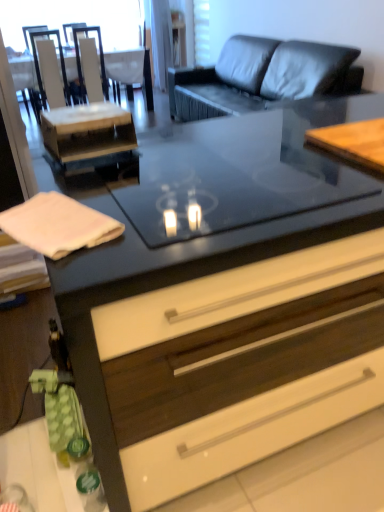
This screenshot has width=384, height=512. Describe the element at coordinates (132, 68) in the screenshot. I see `white wood desk at left` at that location.

You are a GUI agent. You are given a task and a screenshot of the screen. Output one action in this format:
    pyautogui.click(x=<x>, y=<y>)
    Task: Click on the wooden at left
    The width and height of the screenshot is (384, 512).
    Given the screenshot: What is the action you would take?
    pyautogui.click(x=89, y=136)

Find the location of a particular element. Image resolution: width=384 pixels, height=512 pixels. white fabric armchair at upper center, arranged as the 1th armchair when viewed from the right is located at coordinates pyautogui.click(x=130, y=72).

This screenshot has height=512, width=384. What do you see at coordinates (100, 60) in the screenshot?
I see `white glossy armchair at upper left, which is counted as the 2th armchair, starting from the right` at bounding box center [100, 60].

The width and height of the screenshot is (384, 512). Identify the location of matte black drawer at center. (240, 364).

The height and width of the screenshot is (512, 384). Describe the element at coordinates (261, 77) in the screenshot. I see `dark gray leather couch at upper center` at that location.

In order to face white glossy armchair at upper left, the first armchair when ordered from left to right, should I rotate leftwards or rightwards?

To face it directly, rotate left by 18.626 degrees.

Identify the location of white wood desk at left. The width and height of the screenshot is (384, 512). (132, 68).

Considering the relative sizes of white fabric armchair at upper center, which is counted as the 3th armchair, starting from the left, and white wood desk at left in the image provided, is white fabric armchair at upper center, which is counted as the 3th armchair, starting from the left, smaller than white wood desk at left?

Indeed, white fabric armchair at upper center, which is counted as the 3th armchair, starting from the left, has a smaller size compared to white wood desk at left.

Which object is thinner, white fabric armchair at upper center, arranged as the 1th armchair when viewed from the right, or white wood desk at left?

With smaller width is white fabric armchair at upper center, arranged as the 1th armchair when viewed from the right.

Could you tell me if white fabric armchair at upper center, which is counted as the 3th armchair, starting from the left, is facing white wood desk at left?

Yes, white fabric armchair at upper center, which is counted as the 3th armchair, starting from the left, is turned towards white wood desk at left.

From the image's perspective, who appears lower, wooden at left or dark gray leather couch at upper center?

wooden at left is shown below in the image.

From their relative heights in the image, would you say wooden at left is taller or shorter than dark gray leather couch at upper center?

wooden at left is shorter than dark gray leather couch at upper center.

The height and width of the screenshot is (512, 384). What are the coordinates of `studio couch above the wooden at left (from the image's perspective)` in the screenshot? It's located at (261, 77).

Between wooden at left and dark gray leather couch at upper center, which one is positioned in front?

Positioned in front is wooden at left.

From a real-world perspective, which object stands above the other?

white glossy armchair at upper left, which is counted as the 2th armchair, starting from the right, from a real-world perspective.

Does white glossy armchair at upper left, which is counted as the 2th armchair, starting from the right, have a lesser width compared to white wood desk at left?

Yes, white glossy armchair at upper left, which is counted as the 2th armchair, starting from the right, is thinner than white wood desk at left.

Is white glossy armchair at upper left, placed as the 2th armchair when sorted from left to right, oriented away from white wood desk at left?

Yes, white glossy armchair at upper left, placed as the 2th armchair when sorted from left to right, is positioned with its back facing white wood desk at left.

From the image's perspective, is white glossy armchair at upper left, placed as the 2th armchair when sorted from left to right, on white wood desk at left?

Yes, from the image's perspective, white glossy armchair at upper left, placed as the 2th armchair when sorted from left to right, is above white wood desk at left.

Which point is more forward, (x=110, y=70) or (x=40, y=62)?

Positioned in front is point (x=40, y=62).

Would you say white wood desk at left contains white glossy armchair at upper left, which ranks as the 3th armchair in right-to-left order?

Yes, white glossy armchair at upper left, which ranks as the 3th armchair in right-to-left order, is a part of white wood desk at left.

Can you tell me how much white wood desk at left and white glossy armchair at upper left, which ranks as the 3th armchair in right-to-left order, differ in facing direction?

The angular difference between white wood desk at left and white glossy armchair at upper left, which ranks as the 3th armchair in right-to-left order, is 0.467 degrees.

Is white wood desk at left with white glossy armchair at upper left, the first armchair when ordered from left to right?

No, white wood desk at left is not next to white glossy armchair at upper left, the first armchair when ordered from left to right.

From the image's perspective, is wooden table at upper right located above or below dark gray leather couch at upper center?

From the image's perspective, wooden table at upper right appears below dark gray leather couch at upper center.

Would you say wooden table at upper right is inside or outside dark gray leather couch at upper center?

wooden table at upper right is outside dark gray leather couch at upper center.

Is the depth of wooden table at upper right greater than that of dark gray leather couch at upper center?

No.

Can you confirm if wooden table at upper right is thinner than dark gray leather couch at upper center?

Correct, the width of wooden table at upper right is less than that of dark gray leather couch at upper center.

Looking at this image, would you say wooden table at upper right is a long distance from white glossy armchair at upper left, which ranks as the 3th armchair in right-to-left order?

wooden table at upper right is far away from white glossy armchair at upper left, which ranks as the 3th armchair in right-to-left order.

Considering the sizes of wooden table at upper right and white glossy armchair at upper left, which ranks as the 3th armchair in right-to-left order, in the image, is wooden table at upper right wider or thinner than white glossy armchair at upper left, which ranks as the 3th armchair in right-to-left order,?

Clearly, wooden table at upper right has less width compared to white glossy armchair at upper left, which ranks as the 3th armchair in right-to-left order.

Is wooden table at upper right further to camera compared to white glossy armchair at upper left, which ranks as the 3th armchair in right-to-left order?

No, wooden table at upper right is in front of white glossy armchair at upper left, which ranks as the 3th armchair in right-to-left order.

From the image's perspective, who appears lower, wooden table at upper right or white glossy armchair at upper left, which ranks as the 3th armchair in right-to-left order?

wooden table at upper right is shown below in the image.

From their relative heights in the image, would you say matte black drawer at center is taller or shorter than white glossy armchair at upper left, placed as the 2th armchair when sorted from left to right?

Considering their sizes, matte black drawer at center has more height than white glossy armchair at upper left, placed as the 2th armchair when sorted from left to right.

Which is more to the right, matte black drawer at center or white glossy armchair at upper left, which is counted as the 2th armchair, starting from the right?

Positioned to the right is matte black drawer at center.

From the image's perspective, who appears lower, matte black drawer at center or white glossy armchair at upper left, which is counted as the 2th armchair, starting from the right?

matte black drawer at center, from the image's perspective.

Does matte black drawer at center have a lesser width compared to white glossy armchair at upper left, which is counted as the 2th armchair, starting from the right?

Incorrect, the width of matte black drawer at center is not less than that of white glossy armchair at upper left, which is counted as the 2th armchair, starting from the right.

Which armchair is the 2nd one when counting from the right side of the white wood desk at left? Please provide its 2D coordinates.

[(130, 72)]

Where is `side table lying in front of the dark gray leather couch at upper center`? This screenshot has width=384, height=512. side table lying in front of the dark gray leather couch at upper center is located at coordinates (89, 136).

Looking at the image, which one is located closer to white wood desk at left, white fabric armchair at upper center, which is counted as the 3th armchair, starting from the left, or matte black drawer at center?

Among the two, white fabric armchair at upper center, which is counted as the 3th armchair, starting from the left, is located nearer to white wood desk at left.

Which object lies nearer to the anchor point white glossy armchair at upper left, which is counted as the 2th armchair, starting from the right, white wood desk at left or white fabric armchair at upper center, arranged as the 1th armchair when viewed from the right?

white fabric armchair at upper center, arranged as the 1th armchair when viewed from the right, lies closer to white glossy armchair at upper left, which is counted as the 2th armchair, starting from the right, than the other object.

When comparing their distances from dark gray leather couch at upper center, does matte black drawer at center or white glossy armchair at upper left, which is counted as the 2th armchair, starting from the right, seem closer?

The object closer to dark gray leather couch at upper center is white glossy armchair at upper left, which is counted as the 2th armchair, starting from the right.

From the image, which object appears to be farther from matte black drawer at center, dark gray leather couch at upper center or white glossy armchair at upper left, which ranks as the 3th armchair in right-to-left order?

Based on the image, dark gray leather couch at upper center appears to be further to matte black drawer at center.

Which object lies nearer to the anchor point white glossy armchair at upper left, placed as the 2th armchair when sorted from left to right, matte black drawer at center or white fabric armchair at upper center, arranged as the 1th armchair when viewed from the right?

white fabric armchair at upper center, arranged as the 1th armchair when viewed from the right.

Consider the image. Estimate the real-world distances between objects in this image. Which object is further from white glossy armchair at upper left, placed as the 2th armchair when sorted from left to right, white glossy armchair at upper left, the first armchair when ordered from left to right, or matte black drawer at center?

matte black drawer at center lies further to white glossy armchair at upper left, placed as the 2th armchair when sorted from left to right, than the other object.

Which object lies nearer to the anchor point white fabric armchair at upper center, which is counted as the 3th armchair, starting from the left, matte black drawer at center or white wood desk at left?

Among the two, white wood desk at left is located nearer to white fabric armchair at upper center, which is counted as the 3th armchair, starting from the left.

From the picture: Which object lies further to the anchor point white fabric armchair at upper center, which is counted as the 3th armchair, starting from the left, dark gray leather couch at upper center or white glossy armchair at upper left, which is counted as the 2th armchair, starting from the right?

dark gray leather couch at upper center is further to white fabric armchair at upper center, which is counted as the 3th armchair, starting from the left.

Identify the location of side table located between wooden table at upper right and white glossy armchair at upper left, placed as the 2th armchair when sorted from left to right, in the depth direction. (89, 136).

Where is `armchair between wooden at left and white wood desk at left along the z-axis`? The height and width of the screenshot is (512, 384). armchair between wooden at left and white wood desk at left along the z-axis is located at coordinates (54, 70).

Where is `studio couch between wooden at left and white wood desk at left along the z-axis`? studio couch between wooden at left and white wood desk at left along the z-axis is located at coordinates (261, 77).

Find the location of a particular element. Image resolution: width=384 pixels, height=512 pixels. drawer between wooden at left and wooden table at upper right is located at coordinates (240, 364).